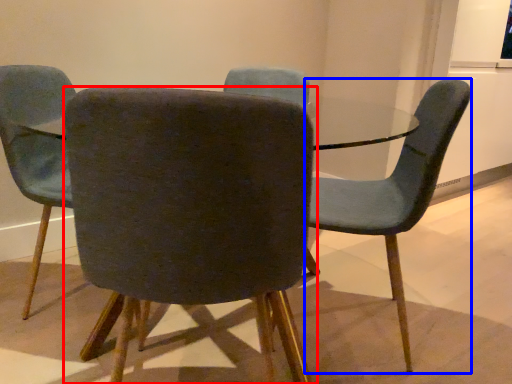
Question: Which point is further to the camera, chair (highlighted by a red box) or chair (highlighted by a blue box)?

Choices:
 (A) chair
 (B) chair

Answer: (B)